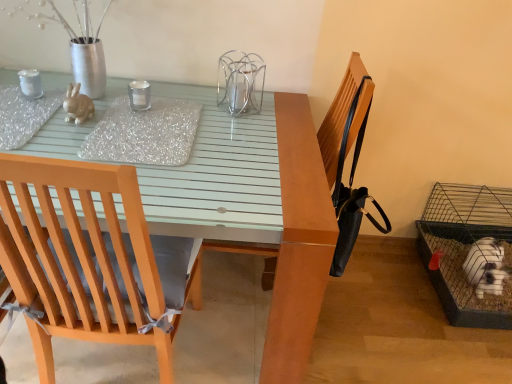
Question: Is matte glass table at center shorter than clear glass candle holder at center, which is the second bird cage in back-to-front order?

Choices:
 (A) no
 (B) yes

Answer: (A)

Question: Can you confirm if matte glass table at center is bigger than clear glass candle holder at center, which is the 1th bird cage from front to back?

Choices:
 (A) no
 (B) yes

Answer: (B)

Question: From the image's perspective, would you say matte glass table at center is shown under clear glass candle holder at center, which is the second bird cage in back-to-front order?

Choices:
 (A) no
 (B) yes

Answer: (B)

Question: Is matte glass table at center outside of clear glass candle holder at center, which is the 1th bird cage from front to back?

Choices:
 (A) no
 (B) yes

Answer: (B)

Question: Can you confirm if matte glass table at center is positioned to the right of clear glass candle holder at center, which is the second bird cage in back-to-front order?

Choices:
 (A) yes
 (B) no

Answer: (B)

Question: Can you see matte glass table at center touching clear glass candle holder at center, the 2th bird cage ordered from the bottom?

Choices:
 (A) no
 (B) yes

Answer: (A)

Question: Does black leather chair at upper right appear on the right side of clear glass candle at center?

Choices:
 (A) yes
 (B) no

Answer: (A)

Question: Considering the relative sizes of black leather chair at upper right and clear glass candle at center in the image provided, is black leather chair at upper right bigger than clear glass candle at center?

Choices:
 (A) no
 (B) yes

Answer: (B)

Question: From the image's perspective, does black leather chair at upper right appear higher than clear glass candle at center?

Choices:
 (A) no
 (B) yes

Answer: (A)

Question: Is black leather chair at upper right completely or partially outside of clear glass candle at center?

Choices:
 (A) no
 (B) yes

Answer: (B)

Question: Is black leather chair at upper right closer to the viewer compared to clear glass candle at center?

Choices:
 (A) no
 (B) yes

Answer: (B)

Question: Is black leather chair at upper right far away from clear glass candle at center?

Choices:
 (A) yes
 (B) no

Answer: (B)

Question: Is matte ceramic rabbit at upper left shorter than black leather chair at upper right?

Choices:
 (A) no
 (B) yes

Answer: (B)